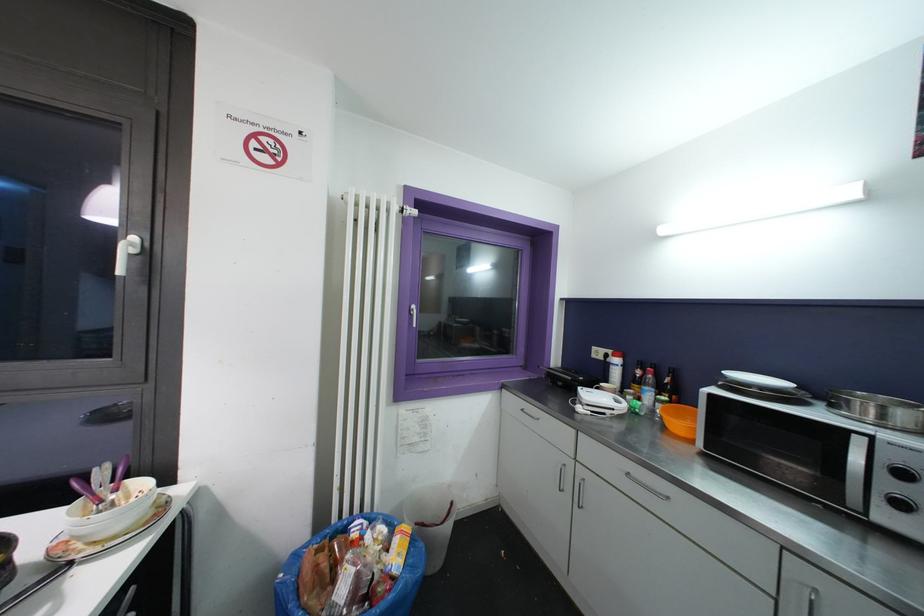
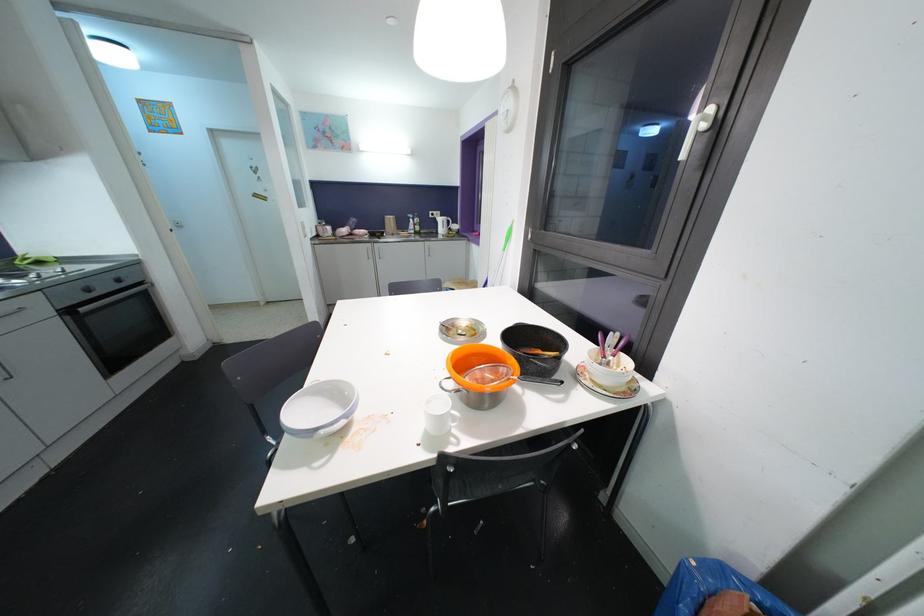
The first image is from the beginning of the video and the second image is from the end. How did the camera likely rotate when shooting the video?

The camera rotated toward left-down.